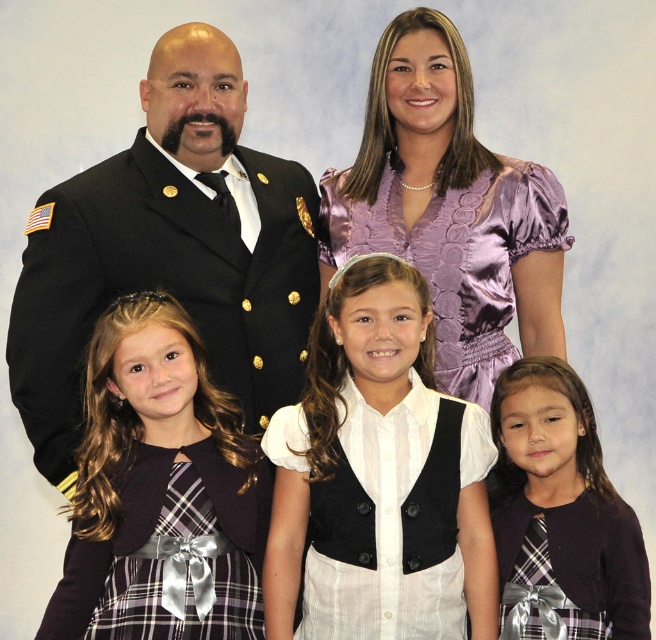
Question: Is plaid fabric dress at lower left to the right of purple satin dress at upper center from the viewer's perspective?

Choices:
 (A) no
 (B) yes

Answer: (A)

Question: Which point is farther from the camera taking this photo?

Choices:
 (A) (445, 496)
 (B) (203, 493)
 (C) (516, 408)
 (D) (58, 209)

Answer: (D)

Question: Does black uniform at left appear on the left side of purple plaid dress at lower right?

Choices:
 (A) no
 (B) yes

Answer: (B)

Question: Does black uniform at left appear on the left side of plaid fabric dress at lower left?

Choices:
 (A) yes
 (B) no

Answer: (B)

Question: Which point appears farthest from the camera in this image?

Choices:
 (A) (140, 234)
 (B) (438, 518)
 (C) (152, 333)
 (D) (520, 532)

Answer: (A)

Question: Based on their relative distances, which object is farther from the plaid fabric dress at lower left?

Choices:
 (A) purple plaid dress at lower right
 (B) black uniform at left
 (C) white button-up shirt at center
 (D) purple satin dress at upper center

Answer: (D)